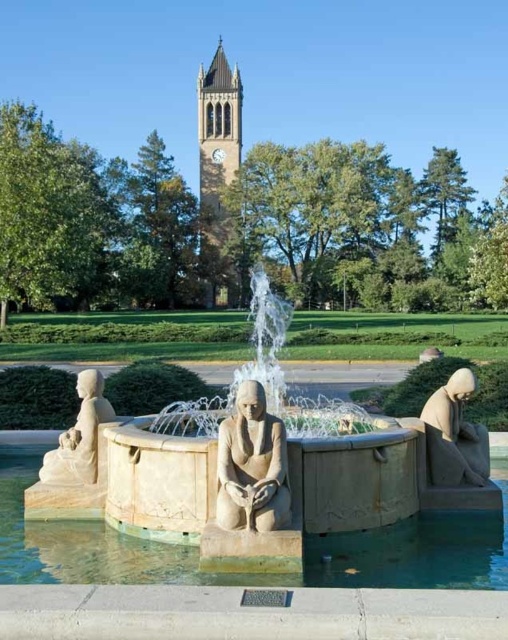
You are a maintenance worker tasked with cleaning the beige stone fountain at center and the smooth stone statue at center. You have a 5 meter long hose. Can you reach both objects without moving the hose? Please explain your reasoning based on the distance between them.

The beige stone fountain at center and smooth stone statue at center are 5.74 meters apart. Since the hose is only 5 meters long, it is 0.74 meters shorter than the required distance. Therefore, you cannot reach both objects without moving the hose.

Looking at this image, you are an architect designing a new public square and want to place both the beige stone fountain at center and the smooth stone fountain at center. Given their sizes, which fountain should be placed closer to the entrance to ensure visitors can easily see both?

The beige stone fountain at center is bigger than the smooth stone fountain at center, so placing the smaller smooth stone fountain at center closer to the entrance will allow visitors to see both without the larger one blocking the view.

You are standing in the outdoor area and want to take a photo of both the smooth stone fountain at center and the smooth stone statue at center. Since you can only focus on one object at a time, which one should you position closer to the camera to ensure it appears in focus while the other remains slightly blurred?

You should position the smooth stone fountain at center closer to the camera because it is to the left of the smooth stone statue at center, so adjusting focus accordingly would allow the fountain to be sharp while the statue is slightly blurred.